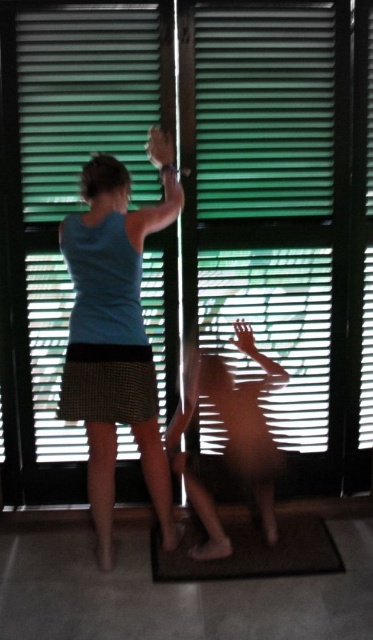
Is green matte blinds at upper center taller than brown textured mat at lower center?

Yes, green matte blinds at upper center is taller than brown textured mat at lower center.

What do you see at coordinates (85, 100) in the screenshot? I see `green matte blinds at upper center` at bounding box center [85, 100].

Between point (33, 193) and point (186, 573), which one is positioned in front?

Point (186, 573)

The height and width of the screenshot is (640, 373). Identify the location of green matte blinds at upper center. (85, 100).

Between green matte blinds at upper center and blue fabric shirt at upper left, which one appears on the left side from the viewer's perspective?

green matte blinds at upper center

In the scene shown: Is the position of green matte blinds at upper center more distant than that of blue fabric shirt at upper left?

Yes, it is.

This screenshot has width=373, height=640. What are the coordinates of `green matte blinds at upper center` in the screenshot? It's located at (85, 100).

Is point (117, 260) closer to viewer compared to point (258, 556)?

Yes.

Which of these two, blue fabric shirt at upper left or brown textured mat at lower center, stands shorter?

brown textured mat at lower center is shorter.

I want to click on blue fabric shirt at upper left, so click(x=116, y=333).